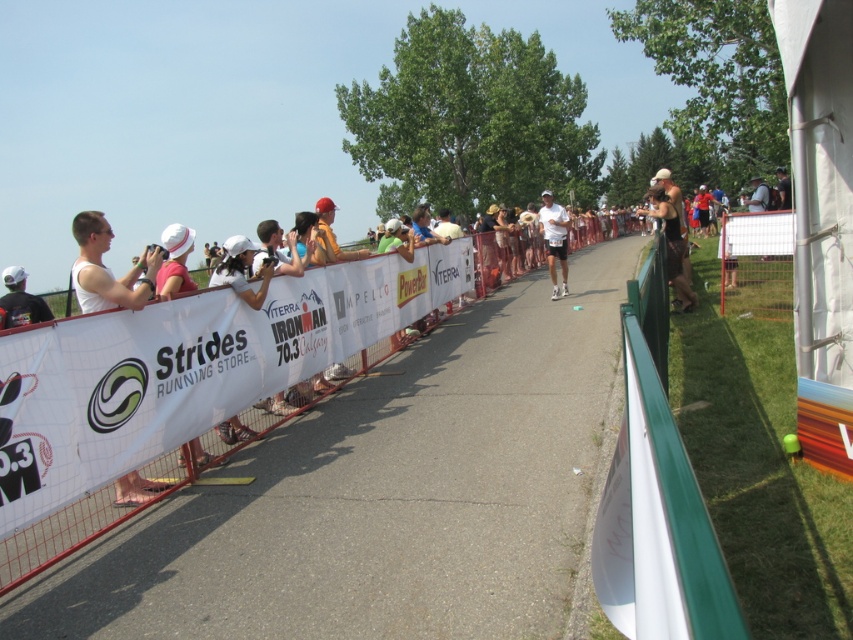
Question: Estimate the real-world distances between objects in this image. Which object is closer to the white matte shirt at center?

Choices:
 (A) white tank top at left
 (B) matte black helmet at upper right
 (C) black matte backpack at left

Answer: (B)

Question: Is white fabric banner at center to the left of black matte backpack at left from the viewer's perspective?

Choices:
 (A) yes
 (B) no

Answer: (B)

Question: Is matte black helmet at upper right above white matte shirt at center?

Choices:
 (A) yes
 (B) no

Answer: (A)

Question: Is white tank top at left closer to camera compared to white matte shirt at center?

Choices:
 (A) no
 (B) yes

Answer: (B)

Question: Considering the real-world distances, which object is farthest from the white fabric banner at center?

Choices:
 (A) black matte backpack at left
 (B) matte black helmet at upper right
 (C) white matte shirt at center
 (D) white tank top at left

Answer: (A)

Question: Among these points, which one is nearest to the camera?

Choices:
 (A) (171, 477)
 (B) (663, 230)

Answer: (A)